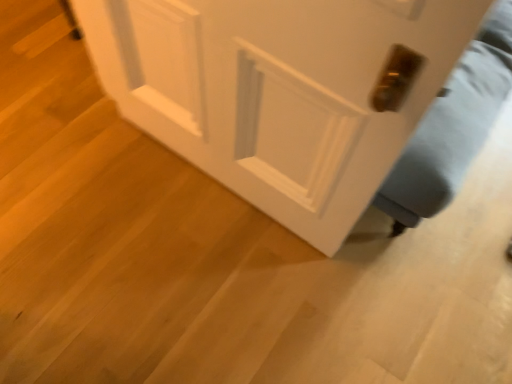
Find the location of a particular element. The height and width of the screenshot is (384, 512). white matte door at center is located at coordinates (282, 91).

This screenshot has width=512, height=384. Describe the element at coordinates (282, 91) in the screenshot. I see `white matte door at center` at that location.

Identify the location of white matte door at center. This screenshot has height=384, width=512. (282, 91).